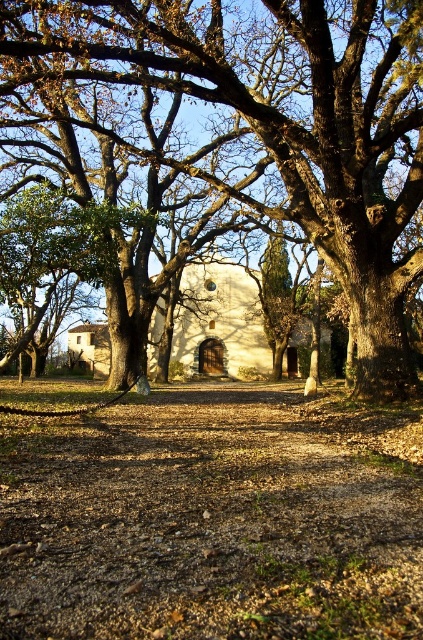
Can you confirm if smooth brown oak tree at center is thinner than white stucco chapel at center?

Yes.

Can you confirm if smooth brown oak tree at center is positioned to the right of white stucco chapel at center?

Correct, you'll find smooth brown oak tree at center to the right of white stucco chapel at center.

Find the location of a particular element. This screenshot has height=640, width=423. smooth brown oak tree at center is located at coordinates (280, 122).

In order to click on smooth brown oak tree at center in this screenshot , I will do `click(280, 122)`.